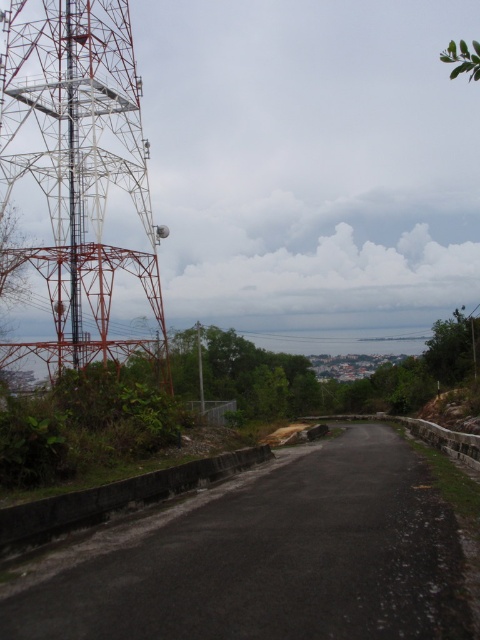
You are standing at the starting point of the road and want to reach a destination located at point (204, 410). There is an obstacle at point (107, 97) blocking your path. Can you safely walk around the obstacle without crossing the road?

Point (107, 97) is closer to you than point (204, 410). Since the obstacle is closer, you can walk around it by moving to the side of the road before proceeding towards your destination.

You are standing at the point marked as point (78, 170) on the image. Based on the scene description, which object are you currently located on?

The point (78, 170) is on the metallic lattice tower at left, so you are currently located on the metallic lattice tower at left.

You are driving a truck that is 12 meters long. You need to pass between the metallic lattice tower at left and the green bamboo pole at center. Can your truck fit through the space between them without going around either object?

The distance between the metallic lattice tower at left and the green bamboo pole at center is 12.12 meters. Since your truck is 12 meters long, it can fit through the space between them as there is enough clearance.